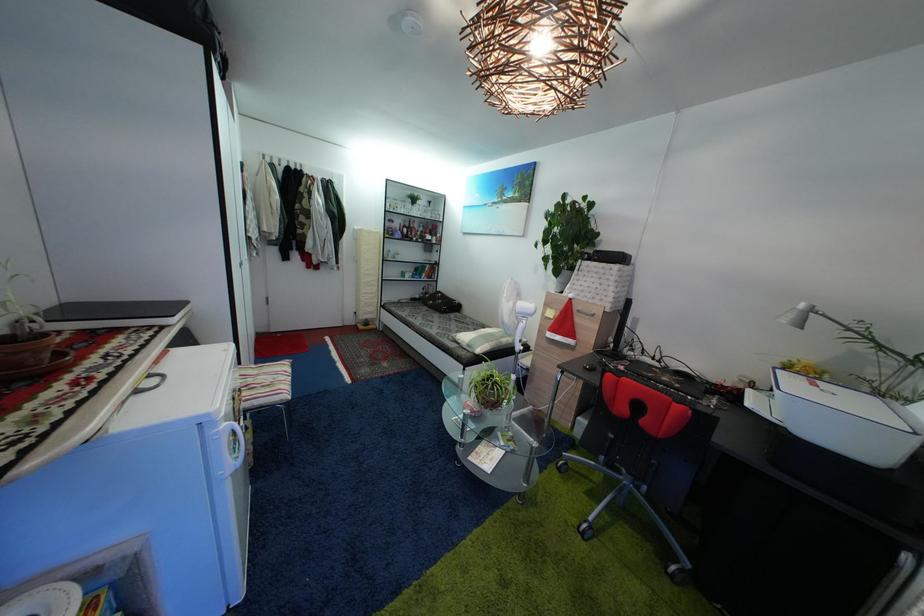
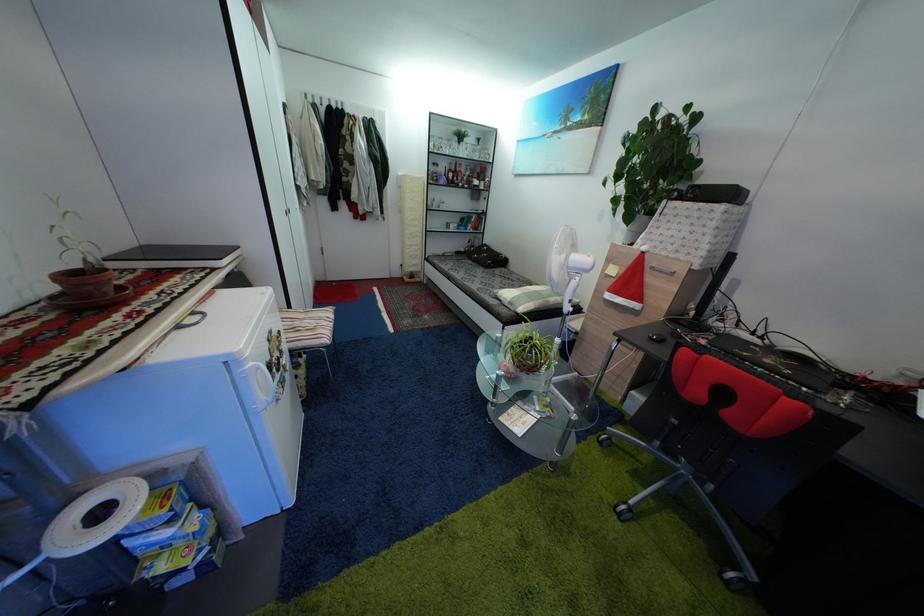
Locate, in the second image, the point that corresponds to (485,456) in the first image.

(517, 418)